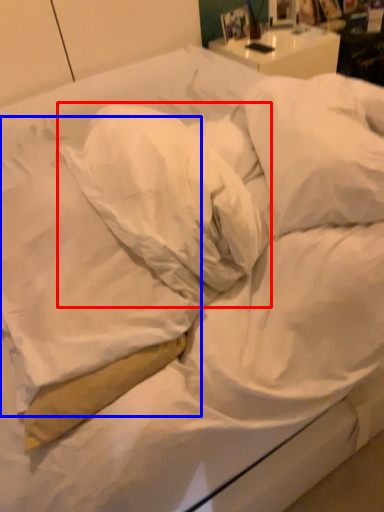
Question: Which object appears closest to the camera in this image, pillow (highlighted by a red box) or pillow (highlighted by a blue box)?

Choices:
 (A) pillow
 (B) pillow

Answer: (B)